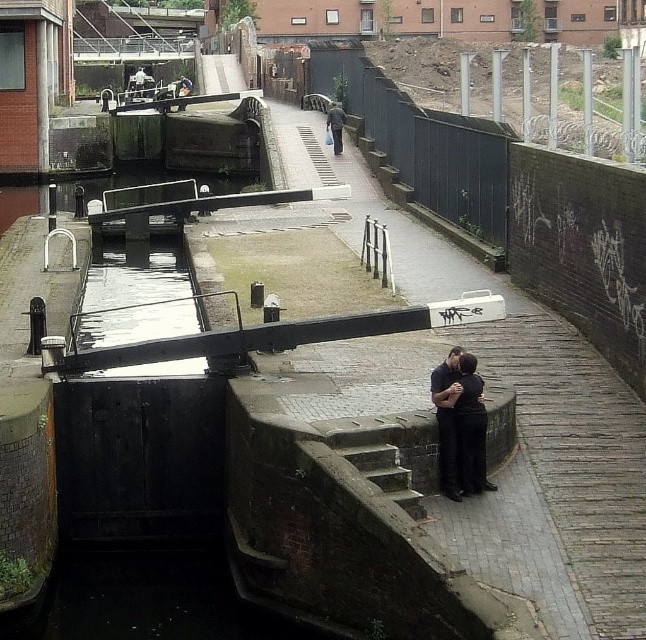
From the picture: You are a city planner reviewing this area to install a new bench. The bench will be placed exactly halfway between the dark gray concrete man at center and the smooth leather jacket at upper center. How far will the bench be from each object?

The bench will be placed exactly halfway between the dark gray concrete man at center and the smooth leather jacket at upper center, which are 43.21 meters apart. Therefore, the bench will be 21.605 meters away from each object.

You are a photographer trying to capture both the black smooth couple at center and the smooth leather jacket at upper center in a single frame. Based on their sizes, which object would you need to focus on more to ensure both are visible in the photo?

The black smooth couple at center occupies less space than the smooth leather jacket at upper center, so you should focus on the smooth leather jacket at upper center to ensure both are visible in the photo.